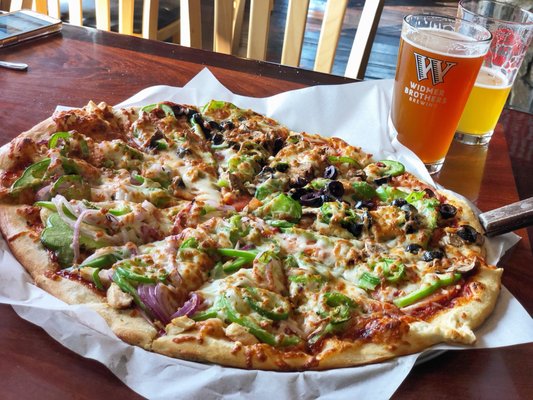
Locate an element on the screen. The width and height of the screenshot is (533, 400). piece of the plate is located at coordinates (429, 358).